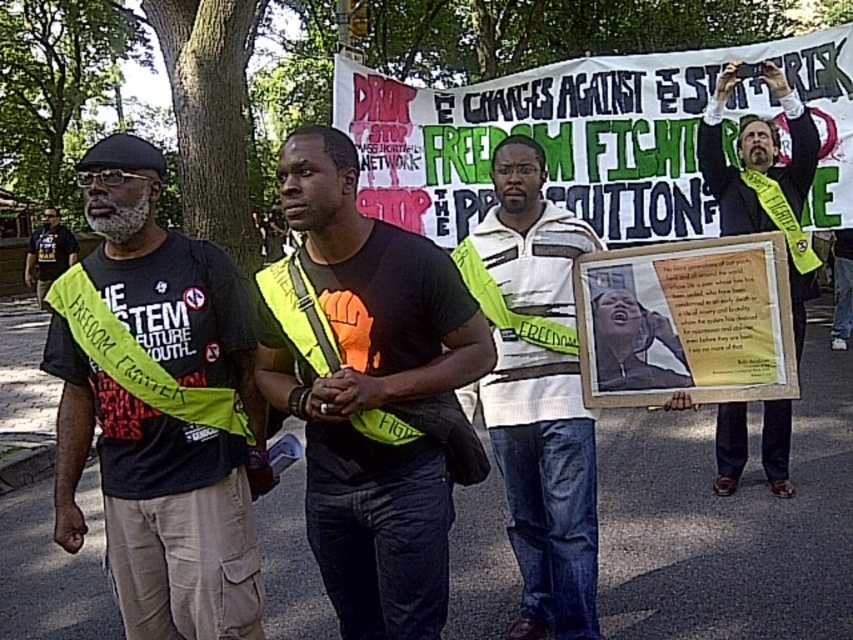
You are standing in the park where the protest is happening. You see two points marked in the scene. Which point, point 1 at (x=177, y=381) or point 2 at (x=776, y=129), is closer to you?

Point 1 at (x=177, y=381) is closer to the viewer than point 2 at (x=776, y=129).